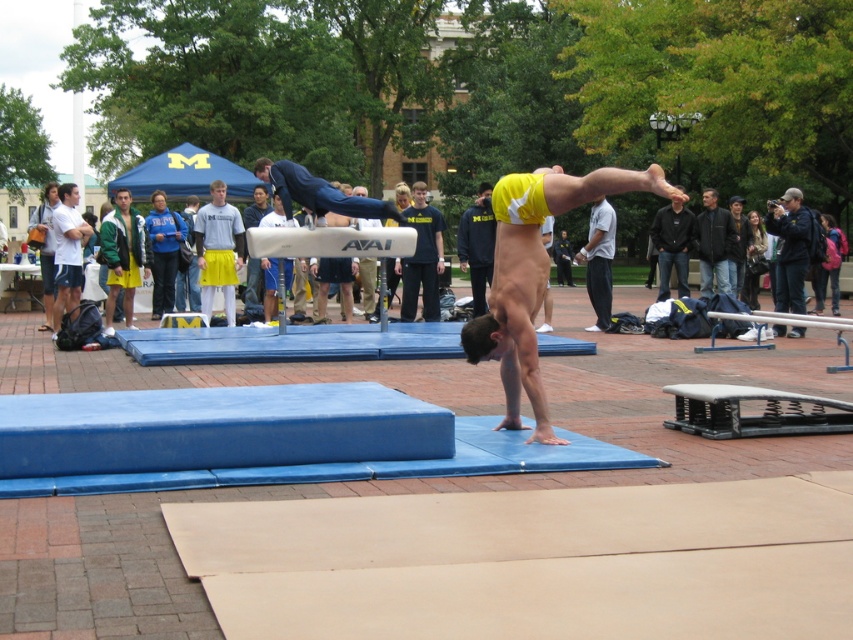
Question: Which object appears farthest from the camera in this image?

Choices:
 (A) yellow shorts at center
 (B) yellow cotton shorts at center
 (C) blue foam mat at lower center

Answer: (A)

Question: Considering the real-world distances, which object is farthest from the yellow cotton shorts at center?

Choices:
 (A) blue jacket at upper right
 (B) silver metallic balance beam at center
 (C) dark blue shirt at center

Answer: (A)

Question: Is blue foam mat at lower center positioned at the back of green/yellow jacket at left?

Choices:
 (A) no
 (B) yes

Answer: (A)

Question: Which object is positioned farthest from the green/yellow jacket at left?

Choices:
 (A) blue jacket at upper right
 (B) dark gray jacket at center
 (C) gray cotton shirt at center

Answer: (A)

Question: Is blue foam mat at lower center wider than dark brown leather jacket at right?

Choices:
 (A) yes
 (B) no

Answer: (B)

Question: Observing the image, what is the correct spatial positioning of blue jacket at upper right in reference to yellow shorts at center?

Choices:
 (A) below
 (B) above

Answer: (B)